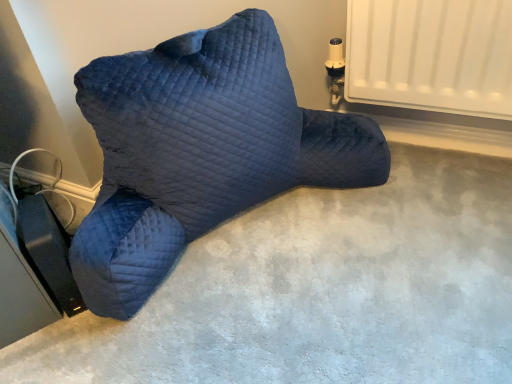
Describe the element at coordinates (320, 291) in the screenshot. I see `velvet blue pillow at center` at that location.

Consider the image. In order to face velvet blue pillow at center, should I rotate leftwards or rightwards?

Turn left by 8.916 degrees to look at velvet blue pillow at center.

Image resolution: width=512 pixels, height=384 pixels. Find the location of `velvet blue pillow at center`. velvet blue pillow at center is located at coordinates (320, 291).

What is the approximate width of velvet blue pillow at center?

velvet blue pillow at center is 14.44 inches wide.

What do you see at coordinates (200, 151) in the screenshot? The image size is (512, 384). I see `velvet blue pillow at center` at bounding box center [200, 151].

The height and width of the screenshot is (384, 512). Find the location of `velvet blue pillow at center`. velvet blue pillow at center is located at coordinates (200, 151).

Find the location of a particular element. velvet blue pillow at center is located at coordinates (320, 291).

Consider the image. Is velvet blue pillow at center to the left of velvet blue pillow at center from the viewer's perspective?

Yes.

Is the depth of velvet blue pillow at center greater than that of velvet blue pillow at center?

No, the depth of velvet blue pillow at center is less than that of velvet blue pillow at center.

Does point (27, 364) come closer to viewer compared to point (213, 204)?

Yes, point (27, 364) is in front of point (213, 204).

From the image's perspective, is velvet blue pillow at center located above or below velvet blue pillow at center?

From the image's perspective, velvet blue pillow at center appears below velvet blue pillow at center.

Consider the image. From a real-world perspective, is velvet blue pillow at center physically above velvet blue pillow at center?

No, from a real-world perspective, velvet blue pillow at center is not over velvet blue pillow at center

Which of these two, velvet blue pillow at center or velvet blue pillow at center, is wider?

velvet blue pillow at center is wider.

Based on the photo, in terms of height, does velvet blue pillow at center look taller or shorter compared to velvet blue pillow at center?

velvet blue pillow at center is shorter than velvet blue pillow at center.

Based on their sizes in the image, would you say velvet blue pillow at center is bigger or smaller than velvet blue pillow at center?

velvet blue pillow at center is smaller than velvet blue pillow at center.

Is velvet blue pillow at center completely or partially inside velvet blue pillow at center?

No, velvet blue pillow at center is not surrounded by velvet blue pillow at center.

Is velvet blue pillow at center far away from velvet blue pillow at center?

No, velvet blue pillow at center is not far from velvet blue pillow at center.

Is velvet blue pillow at center oriented away from velvet blue pillow at center?

No, velvet blue pillow at center is not facing the opposite direction of velvet blue pillow at center.

Measure the distance from velvet blue pillow at center to velvet blue pillow at center.

velvet blue pillow at center is 21.63 centimeters away from velvet blue pillow at center.

At what (x,y) coordinates should I click in order to perform the action: click on concrete that is in front of the velvet blue pillow at center. Please return your answer as a coordinate pair (x, y). Looking at the image, I should click on (320, 291).

Can you confirm if velvet blue pillow at center is positioned to the left of velvet blue pillow at center?

No.

In the image, is velvet blue pillow at center positioned in front of or behind velvet blue pillow at center?

Clearly, velvet blue pillow at center is behind velvet blue pillow at center.

Is point (387, 154) closer or farther from the camera than point (490, 309)?

Point (387, 154).

From the image's perspective, is velvet blue pillow at center positioned above or below velvet blue pillow at center?

From the image's perspective, velvet blue pillow at center appears above velvet blue pillow at center.

In the scene shown: From a real-world perspective, who is located lower, velvet blue pillow at center or velvet blue pillow at center?

From a 3D spatial view, velvet blue pillow at center is below.

Is velvet blue pillow at center thinner than velvet blue pillow at center?

Correct, the width of velvet blue pillow at center is less than that of velvet blue pillow at center.

Is velvet blue pillow at center taller or shorter than velvet blue pillow at center?

Clearly, velvet blue pillow at center is taller compared to velvet blue pillow at center.

Can you confirm if velvet blue pillow at center is bigger than velvet blue pillow at center?

Yes, velvet blue pillow at center is bigger than velvet blue pillow at center.

Can we say velvet blue pillow at center lies outside velvet blue pillow at center?

Yes, velvet blue pillow at center is located beyond the bounds of velvet blue pillow at center.

Is velvet blue pillow at center not near velvet blue pillow at center?

No, velvet blue pillow at center is not far away from velvet blue pillow at center.

Is velvet blue pillow at center facing towards velvet blue pillow at center?

No, velvet blue pillow at center is not facing towards velvet blue pillow at center.

How far apart are velvet blue pillow at center and velvet blue pillow at center?

velvet blue pillow at center is 8.52 inches away from velvet blue pillow at center.

In the image, there is a velvet blue pillow at center. Where is `concrete below it (from a real-world perspective)`? The image size is (512, 384). concrete below it (from a real-world perspective) is located at coordinates (320, 291).

Where is `concrete in front of the velvet blue pillow at center`? The width and height of the screenshot is (512, 384). concrete in front of the velvet blue pillow at center is located at coordinates (320, 291).

The width and height of the screenshot is (512, 384). I want to click on concrete that is below the velvet blue pillow at center (from the image's perspective), so click(x=320, y=291).